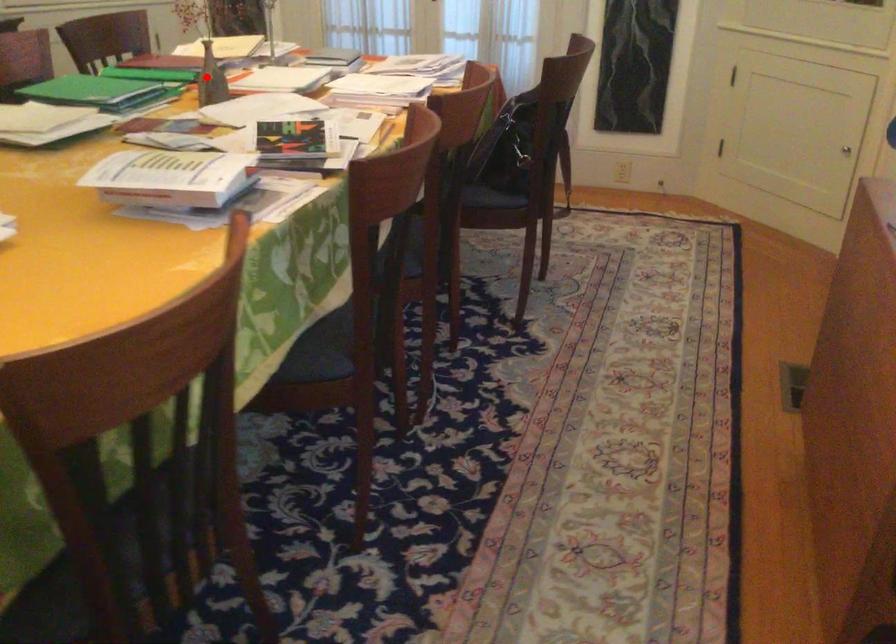
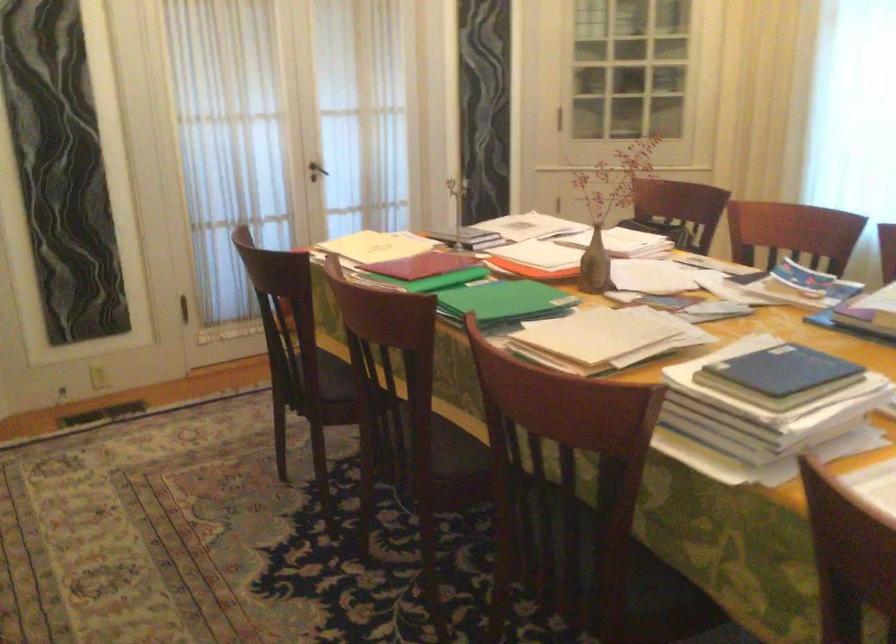
In the second image, find the point that corresponds to the highlighted location in the first image.

(595, 265)